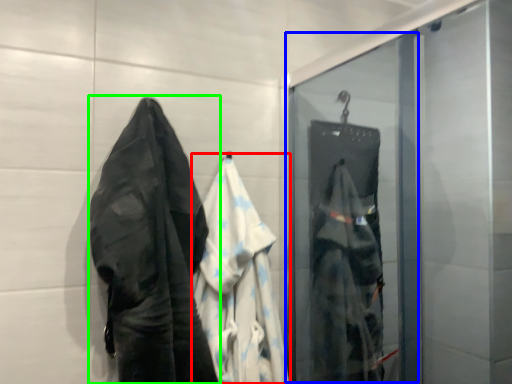
Question: Which object is positioned closest to garment (highlighted by a red box)? Select from screen door (highlighted by a blue box) and towel (highlighted by a green box).

Choices:
 (A) screen door
 (B) towel

Answer: (B)